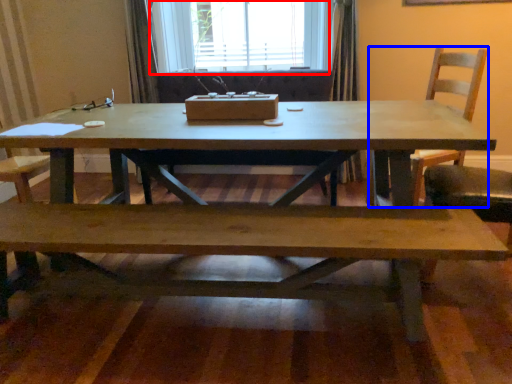
Question: Which object appears farthest to the camera in this image, window (highlighted by a red box) or chair (highlighted by a blue box)?

Choices:
 (A) window
 (B) chair

Answer: (A)